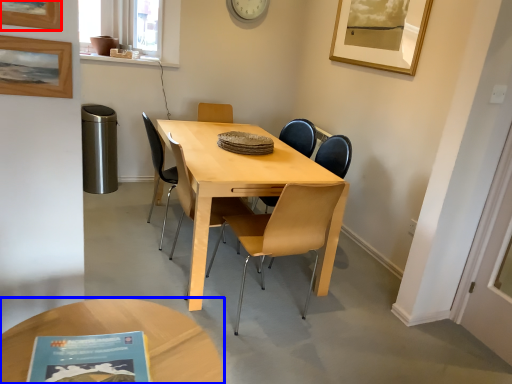
Question: Which point is closer to the camera, picture frame (highlighted by a red box) or coffee table (highlighted by a blue box)?

Choices:
 (A) picture frame
 (B) coffee table

Answer: (B)